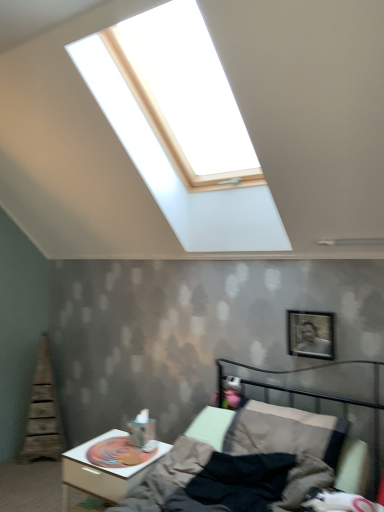
You are a GUI agent. You are given a task and a screenshot of the screen. Output one action in this format:
    pyautogui.click(x=<x>, y=<y>)
    Task: Click on the free point above white glossy nightstand at lower left (from a real-world perspective)
    Image resolution: width=384 pixels, height=512 pixels.
    Given the screenshot: What is the action you would take?
    pyautogui.click(x=115, y=445)